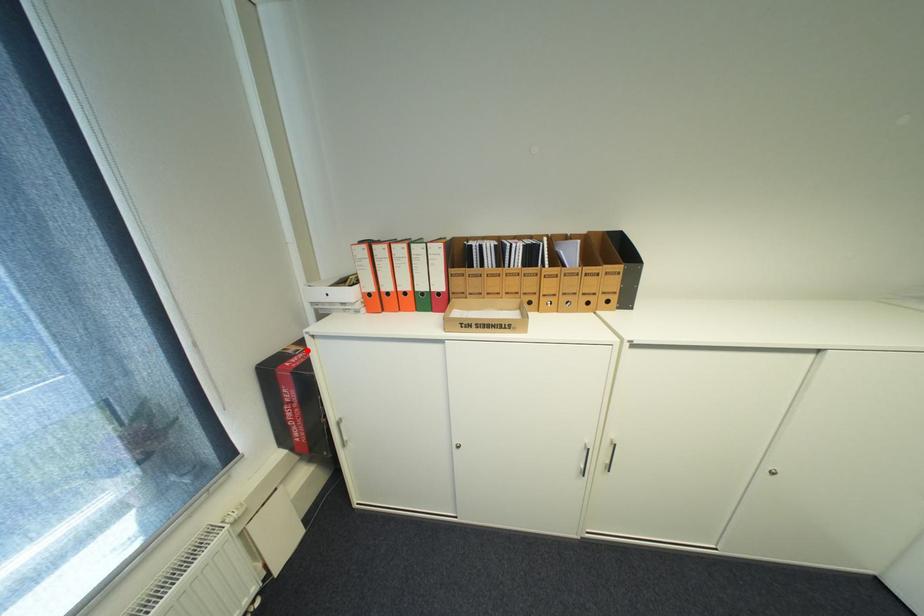
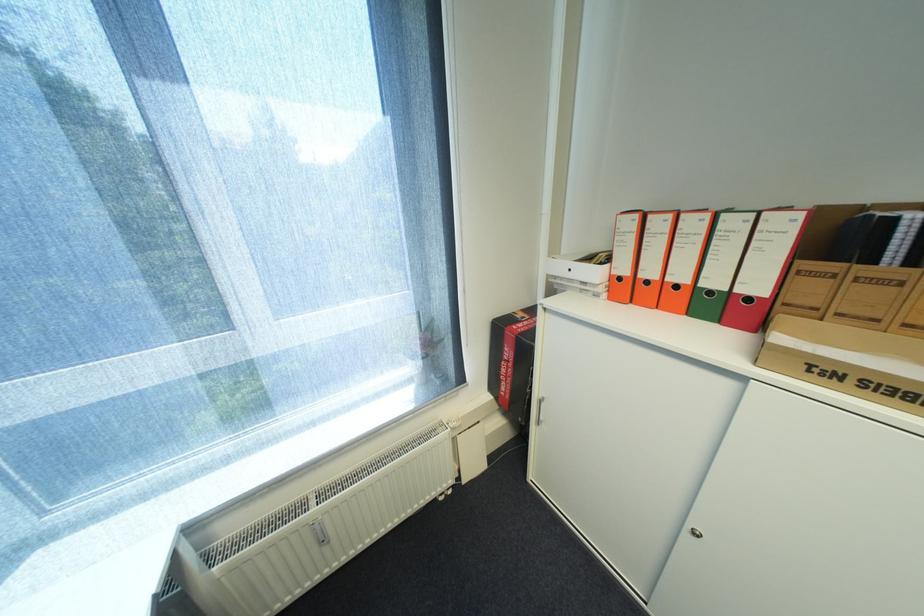
Where in the second image is the point corresponding to the highlighted location from the first image?

(532, 318)